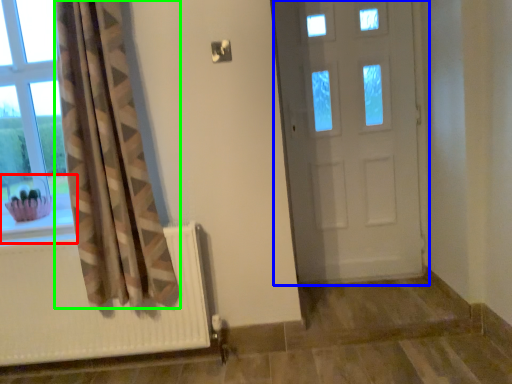
Question: Based on their relative distances, which object is farther from window sill (highlighted by a red box)? Choose from door (highlighted by a blue box) and curtain (highlighted by a green box).

Choices:
 (A) door
 (B) curtain

Answer: (A)